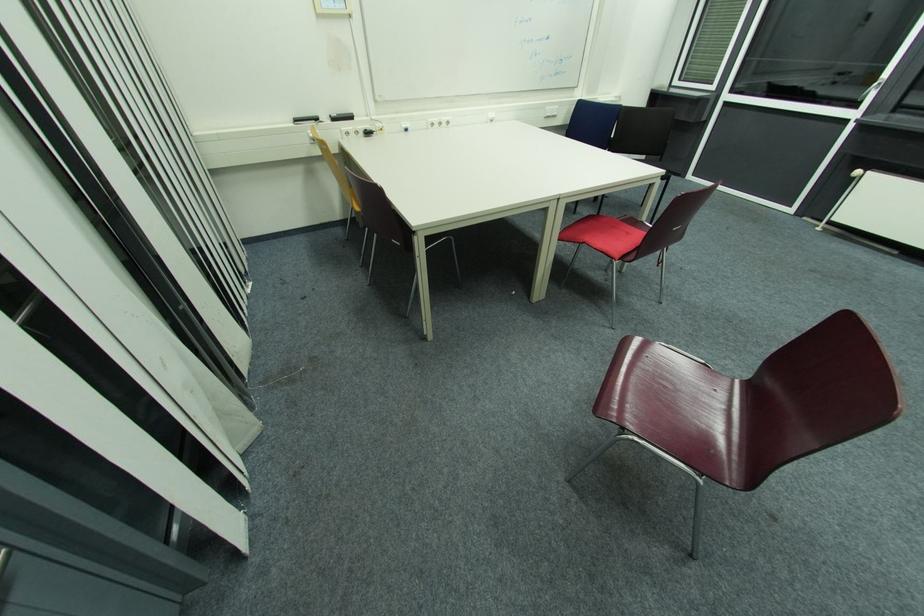
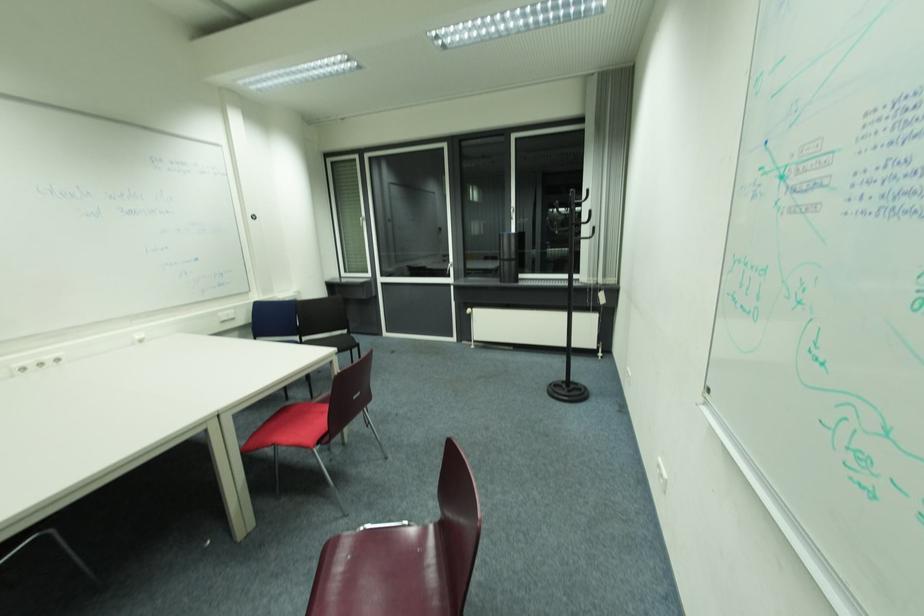
First-person continuous shooting, in which direction is the camera rotating?

The camera's rotation is toward right-up.